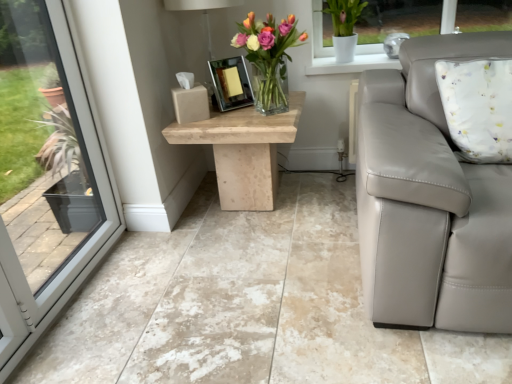
The image size is (512, 384). I want to click on beige marble floor at center, so click(232, 301).

What do you see at coordinates (243, 151) in the screenshot? Image resolution: width=512 pixels, height=384 pixels. I see `natural stone table at center` at bounding box center [243, 151].

Image resolution: width=512 pixels, height=384 pixels. In order to click on matte white lamp at upper center in this screenshot , I will do `click(202, 13)`.

This screenshot has height=384, width=512. What do you see at coordinates (268, 57) in the screenshot?
I see `translucent glass vase at center` at bounding box center [268, 57].

The height and width of the screenshot is (384, 512). I want to click on translucent glass vase at center, so click(x=268, y=57).

This screenshot has height=384, width=512. I want to click on beige marble floor at center, so click(232, 301).

Can you tell me how much matte white lamp at upper center and translucent glass vase at center differ in facing direction?

9.73e-05 degrees separate the facing orientations of matte white lamp at upper center and translucent glass vase at center.

Considering the sizes of matte white lamp at upper center and translucent glass vase at center in the image, is matte white lamp at upper center taller or shorter than translucent glass vase at center?

matte white lamp at upper center is taller than translucent glass vase at center.

Which is in front, matte white lamp at upper center or translucent glass vase at center?

translucent glass vase at center is closer to the camera.

Are matte white lamp at upper center and translucent glass vase at center located far from each other?

No.

Is beige marble floor at center aimed at translucent glass vase at center?

No, beige marble floor at center is not oriented towards translucent glass vase at center.

Are beige marble floor at center and translucent glass vase at center far apart?

Actually, beige marble floor at center and translucent glass vase at center are a little close together.

In order to click on floral arrangement that appears behind the beige marble floor at center in this screenshot , I will do `click(268, 57)`.

Which object is thinner, beige marble floor at center or translucent glass vase at center?

With smaller width is translucent glass vase at center.

Does point (322, 190) come in front of point (233, 5)?

That is False.

Is beige marble floor at center positioned far away from matte white lamp at upper center?

Absolutely, beige marble floor at center is distant from matte white lamp at upper center.

Can you confirm if beige marble floor at center is smaller than matte white lamp at upper center?

No, beige marble floor at center is not smaller than matte white lamp at upper center.

Is matte white lamp at upper center surrounded by beige marble floor at center?

No, matte white lamp at upper center is not inside beige marble floor at center.

From a real-world perspective, is translucent glass vase at center over shiny silver picture frame at center?

Indeed, from a real-world perspective, translucent glass vase at center stands above shiny silver picture frame at center.

Who is taller, translucent glass vase at center or shiny silver picture frame at center?

translucent glass vase at center.

How much distance is there between translucent glass vase at center and shiny silver picture frame at center?

They are 7.11 inches apart.

Which is closer, (291, 28) or (224, 79)?

Point (291, 28).

Considering their positions, is natural stone table at center located in front of or behind shiny silver picture frame at center?

natural stone table at center is positioned closer to the viewer than shiny silver picture frame at center.

Which of these two, natural stone table at center or shiny silver picture frame at center, stands shorter?

shiny silver picture frame at center is shorter.

At what (x,y) coordinates should I click in order to perform the action: click on picture frame above the natural stone table at center (from the image's perspective). Please return your answer as a coordinate pair (x, y). Looking at the image, I should click on (231, 83).

Does natural stone table at center have a greater width compared to shiny silver picture frame at center?

Yes.

From the image's perspective, is translucent glass vase at center located above beige marble floor at center?

Yes, from the image's perspective, translucent glass vase at center is above beige marble floor at center.

Does point (275, 87) appear closer or farther from the camera than point (167, 347)?

Point (275, 87) appears to be farther away from the viewer than point (167, 347).

Does translucent glass vase at center have a greater width compared to beige marble floor at center?

In fact, translucent glass vase at center might be narrower than beige marble floor at center.

Is the surface of translucent glass vase at center in direct contact with beige marble floor at center?

translucent glass vase at center and beige marble floor at center are clearly separated.

Who is more distant, beige marble floor at center or shiny silver picture frame at center?

shiny silver picture frame at center is behind.

In the scene shown: Is beige marble floor at center shorter than shiny silver picture frame at center?

Correct, beige marble floor at center is not as tall as shiny silver picture frame at center.

Is point (136, 257) behind point (246, 77)?

That is False.

In the image, there is a matte white lamp at upper center. Identify the location of floral arrangement below it (from the image's perspective). (268, 57).

Locate an element on the screen. concrete that appears on the left of translucent glass vase at center is located at coordinates (232, 301).

Considering their positions, is matte white lamp at upper center positioned closer to beige marble floor at center than translucent glass vase at center?

The object closer to beige marble floor at center is translucent glass vase at center.

Which object lies further to the anchor point natural stone table at center, translucent glass vase at center or beige marble floor at center?

beige marble floor at center lies further to natural stone table at center than the other object.

Which object lies further to the anchor point translucent glass vase at center, natural stone table at center or shiny silver picture frame at center?

Among the two, natural stone table at center is located further to translucent glass vase at center.

When comparing their distances from natural stone table at center, does beige marble floor at center or matte white lamp at upper center seem closer?

Among the two, beige marble floor at center is located nearer to natural stone table at center.

Estimate the real-world distances between objects in this image. Which object is closer to shiny silver picture frame at center, matte white lamp at upper center or natural stone table at center?

natural stone table at center is closer to shiny silver picture frame at center.

Which object lies further to the anchor point matte white lamp at upper center, translucent glass vase at center or shiny silver picture frame at center?

The object further to matte white lamp at upper center is shiny silver picture frame at center.

Considering their positions, is shiny silver picture frame at center positioned closer to natural stone table at center than matte white lamp at upper center?

shiny silver picture frame at center lies closer to natural stone table at center than the other object.

From the image, which object appears to be nearer to translucent glass vase at center, matte white lamp at upper center or shiny silver picture frame at center?

shiny silver picture frame at center lies closer to translucent glass vase at center than the other object.

In order to click on floral arrangement between matte white lamp at upper center and natural stone table at center vertically in this screenshot , I will do `click(268, 57)`.

Find the location of a particular element. floral arrangement between matte white lamp at upper center and beige marble floor at center from top to bottom is located at coordinates (268, 57).

The width and height of the screenshot is (512, 384). I want to click on picture frame between translucent glass vase at center and natural stone table at center in the vertical direction, so click(231, 83).

At what (x,y) coordinates should I click in order to perform the action: click on table between beige marble floor at center and shiny silver picture frame at center in the front-back direction. Please return your answer as a coordinate pair (x, y). The width and height of the screenshot is (512, 384). Looking at the image, I should click on (243, 151).